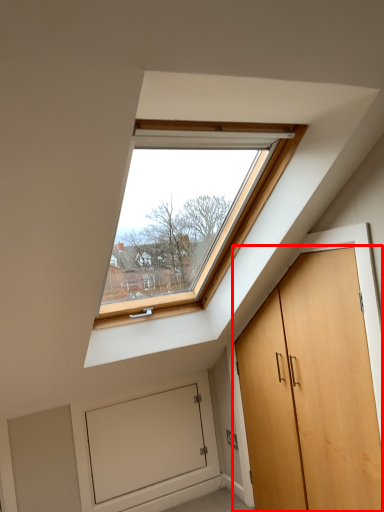
Question: Observing the image, what is the correct spatial positioning of door (annotated by the red box) in reference to garage door?

Choices:
 (A) left
 (B) right

Answer: (B)